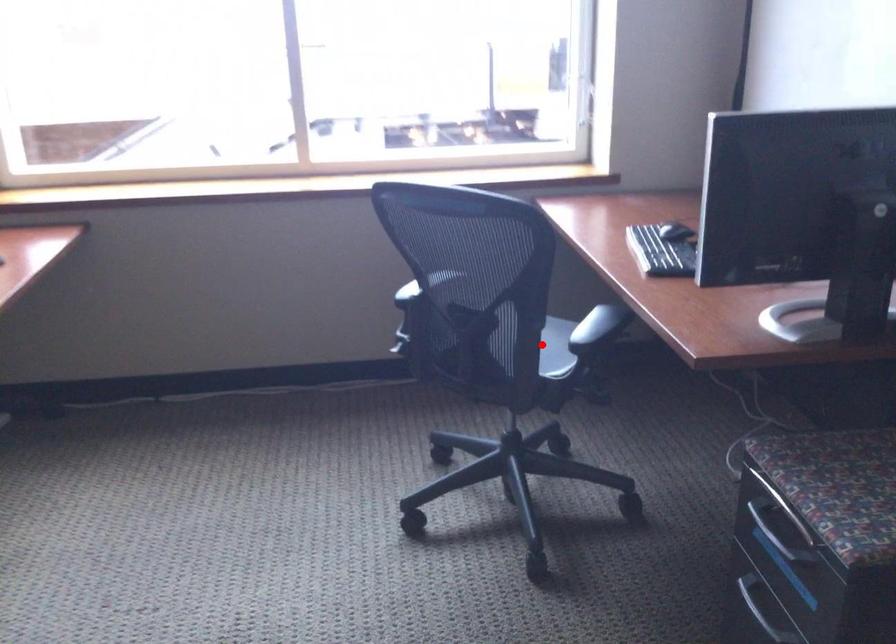
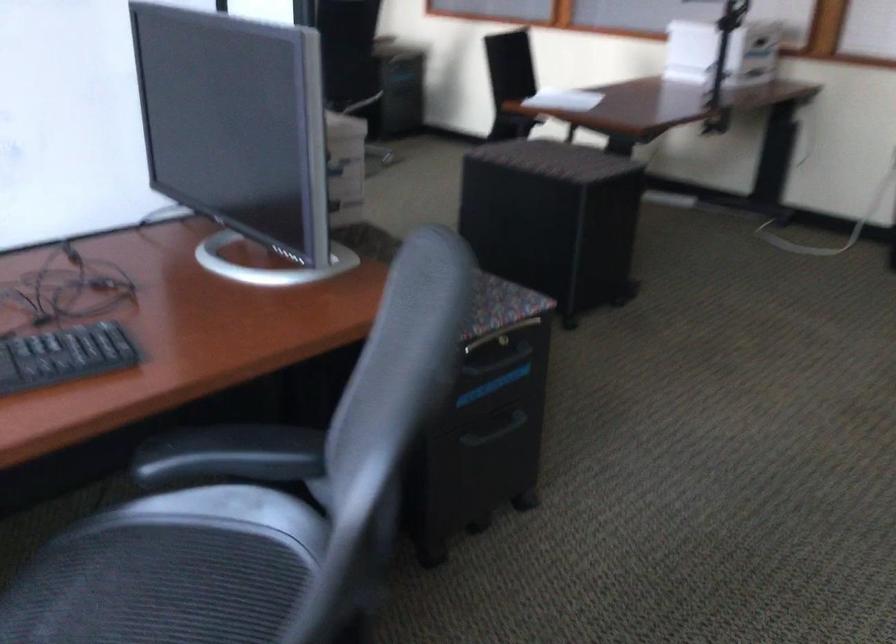
Question: I am providing you with two images of the same scene from different viewpoints. A red point is marked on the first image. At the location where the point appears in image 1, is it still visible in image 2?

Choices:
 (A) Yes
 (B) No

Answer: (B)